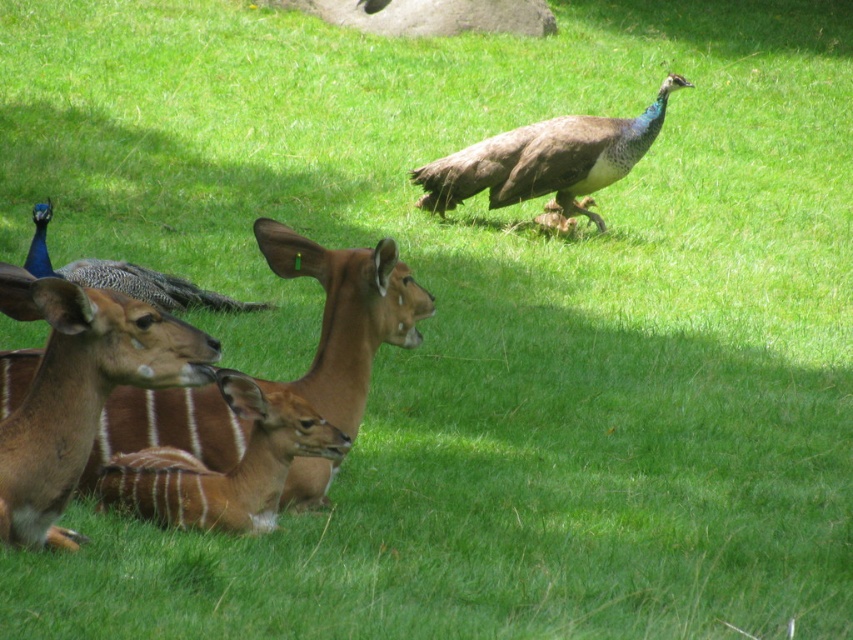
You are standing at the point marked by point (79, 390) in the image. Looking around, you see a brown velvet deer at left and the other animals in the scene. Which direction should you walk to reach the nearest peacock?

The point (79, 390) marks the brown velvet deer at left. Since the peacocks are in the background, you should walk towards the background direction to reach the nearest peacock.

You are a wildlife photographer aiming to capture a closeup of the brown velvet antelope at left. You are currently positioned at point (347, 314). Can you take the photo without moving from your current position?

Yes, because the brown velvet antelope at left is located exactly at point (347, 314) where you are standing, so you can take the photo from your current position.